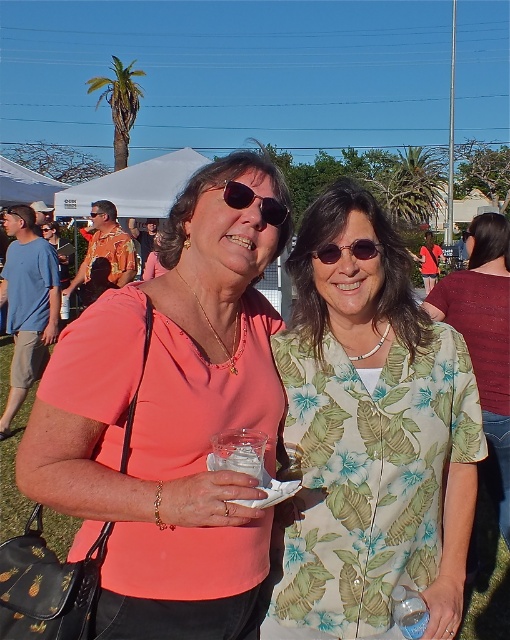
Question: Is green leaf-patterned blouse at center wider than sunglasses at center?

Choices:
 (A) no
 (B) yes

Answer: (B)

Question: Which of the following is the farthest from the observer?

Choices:
 (A) (324, 248)
 (B) (250, 193)

Answer: (A)

Question: Among these points, which one is farthest from the camera?

Choices:
 (A) (234, 195)
 (B) (194, 225)

Answer: (B)

Question: Is green leaf-patterned blouse at center below floral print blouse at center?

Choices:
 (A) yes
 (B) no

Answer: (A)

Question: Which of these objects is positioned closest to the floral print blouse at center?

Choices:
 (A) sunglasses at center
 (B) matte coral shirt at center

Answer: (A)

Question: Can you confirm if green leaf-patterned blouse at center is positioned to the left of matte black sunglasses at center?

Choices:
 (A) no
 (B) yes

Answer: (A)